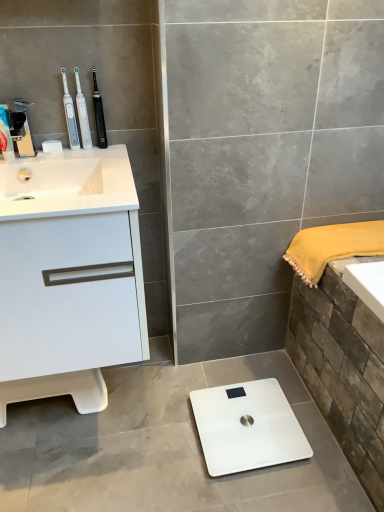
Locate an element on the screen. The width and height of the screenshot is (384, 512). free space in front of black plastic toothbrush at upper center, acting as the 3th toothbrush starting from the left is located at coordinates coord(99,160).